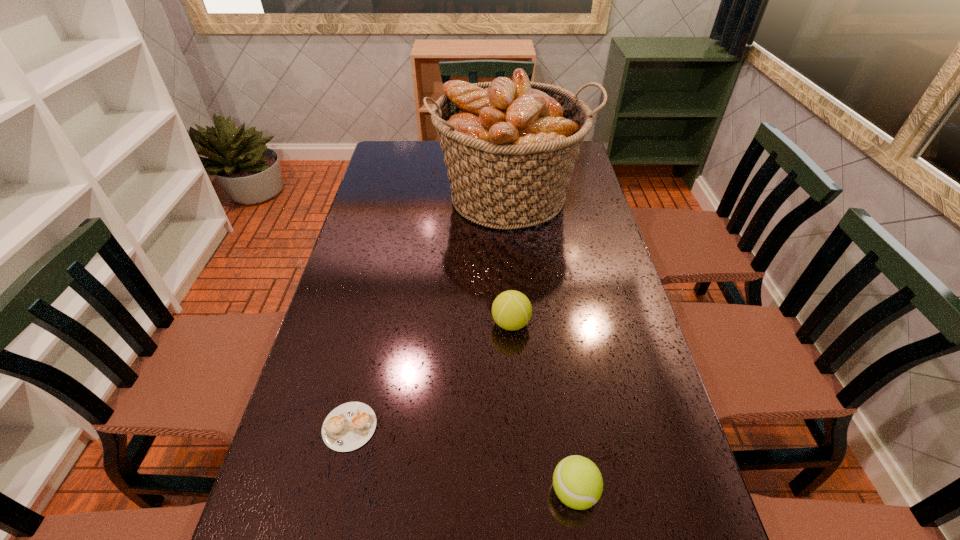
At what (x,y) coordinates should I click in order to perform the action: click on object that stands as the second closest to the left tennis ball. Please return your answer as a coordinate pair (x, y). Image resolution: width=960 pixels, height=540 pixels. Looking at the image, I should click on (349, 426).

The image size is (960, 540). Identify the location of the closest object to the second farthest object. (509, 147).

Find the location of a particular element. This screenshot has height=540, width=960. free location that satisfies the following two spatial constraints: 1. on the front side of the farther tennis ball; 2. on the right side of the right tennis ball is located at coordinates click(522, 491).

I want to click on free region that satisfies the following two spatial constraints: 1. on the front side of the nearest object; 2. on the right side of the farther tennis ball, so click(x=522, y=491).

This screenshot has height=540, width=960. I want to click on free space that satisfies the following two spatial constraints: 1. on the back side of the shortest object; 2. on the right side of the tallest object, so click(x=401, y=197).